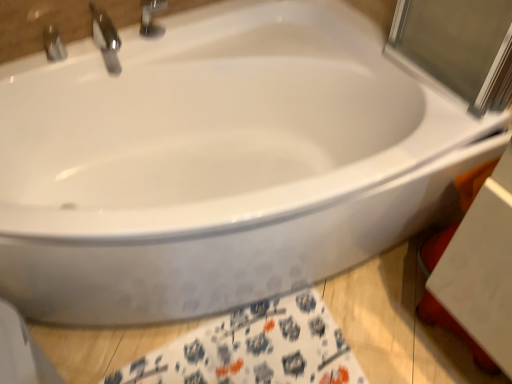
Locate an element on the screen. This screenshot has height=384, width=512. vacant point to the right of metallic silver faucet at upper left, the first tap positioned from the left is located at coordinates (97, 52).